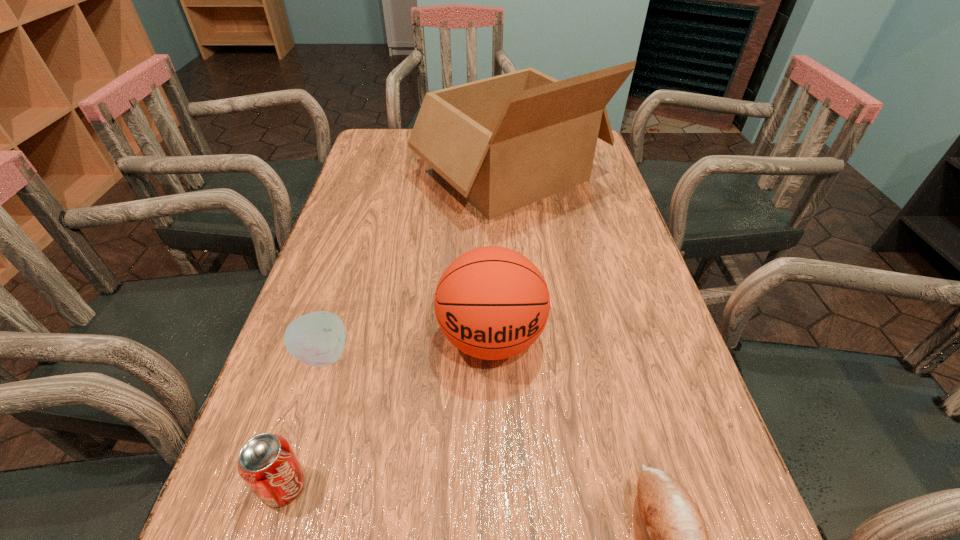
Select which object appears as the second closest to the apple. Please provide its 2D coordinates. Your answer should be formatted as a tuple, i.e. [(x, y)], where the tuple contains the x and y coordinates of a point satisfying the conditions above.

[(492, 303)]

Identify the location of vacant point that satisfies the following two spatial constraints: 1. on the front side of the apple; 2. on the right side of the soda can. The image size is (960, 540). (282, 485).